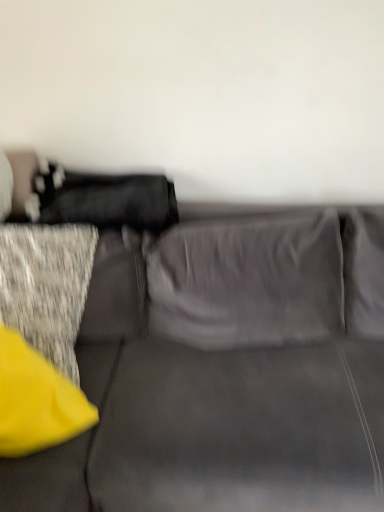
Question: Is suede gray couch at center with yellow fabric pillow at lower left?

Choices:
 (A) no
 (B) yes

Answer: (A)

Question: Considering the relative sizes of suede gray couch at center and yellow fabric pillow at lower left in the image provided, is suede gray couch at center thinner than yellow fabric pillow at lower left?

Choices:
 (A) no
 (B) yes

Answer: (A)

Question: Is suede gray couch at center turned away from yellow fabric pillow at lower left?

Choices:
 (A) no
 (B) yes

Answer: (A)

Question: Is suede gray couch at center not inside yellow fabric pillow at lower left?

Choices:
 (A) no
 (B) yes

Answer: (B)

Question: Can you confirm if suede gray couch at center is bigger than yellow fabric pillow at lower left?

Choices:
 (A) yes
 (B) no

Answer: (A)

Question: Is suede gray couch at center in front of yellow fabric pillow at lower left?

Choices:
 (A) no
 (B) yes

Answer: (B)

Question: Does yellow fabric pillow at lower left have a lesser height compared to suede gray couch at center?

Choices:
 (A) no
 (B) yes

Answer: (B)

Question: Is yellow fabric pillow at lower left to the left of suede gray couch at center from the viewer's perspective?

Choices:
 (A) yes
 (B) no

Answer: (A)

Question: Does yellow fabric pillow at lower left touch suede gray couch at center?

Choices:
 (A) no
 (B) yes

Answer: (A)

Question: Does yellow fabric pillow at lower left have a smaller size compared to suede gray couch at center?

Choices:
 (A) yes
 (B) no

Answer: (A)

Question: Is the position of yellow fabric pillow at lower left less distant than that of suede gray couch at center?

Choices:
 (A) no
 (B) yes

Answer: (A)

Question: From the image's perspective, would you say yellow fabric pillow at lower left is shown under suede gray couch at center?

Choices:
 (A) yes
 (B) no

Answer: (A)

Question: Is point (119, 473) positioned closer to the camera than point (76, 393)?

Choices:
 (A) closer
 (B) farther

Answer: (A)